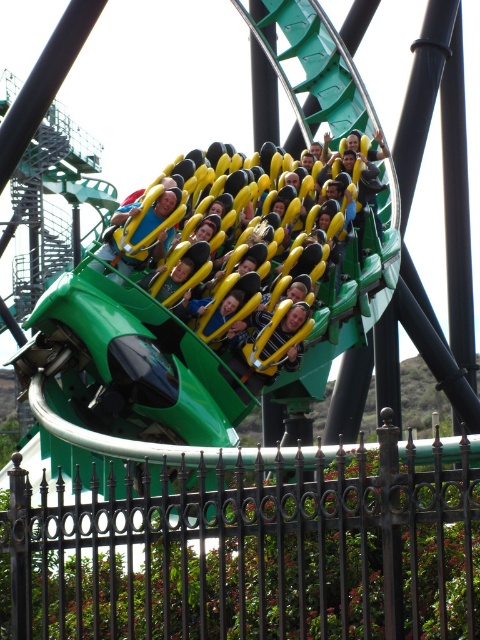
Question: Which point is closer to the camera taking this photo?

Choices:
 (A) (104, 289)
 (B) (96, 262)

Answer: (A)

Question: Can you confirm if green matte roller coaster at center is positioned below yellow padded seat at center?

Choices:
 (A) no
 (B) yes

Answer: (B)

Question: Is green matte roller coaster at center positioned before yellow padded seat at center?

Choices:
 (A) no
 (B) yes

Answer: (B)

Question: Is green matte roller coaster at center above yellow padded seat at center?

Choices:
 (A) yes
 (B) no

Answer: (B)